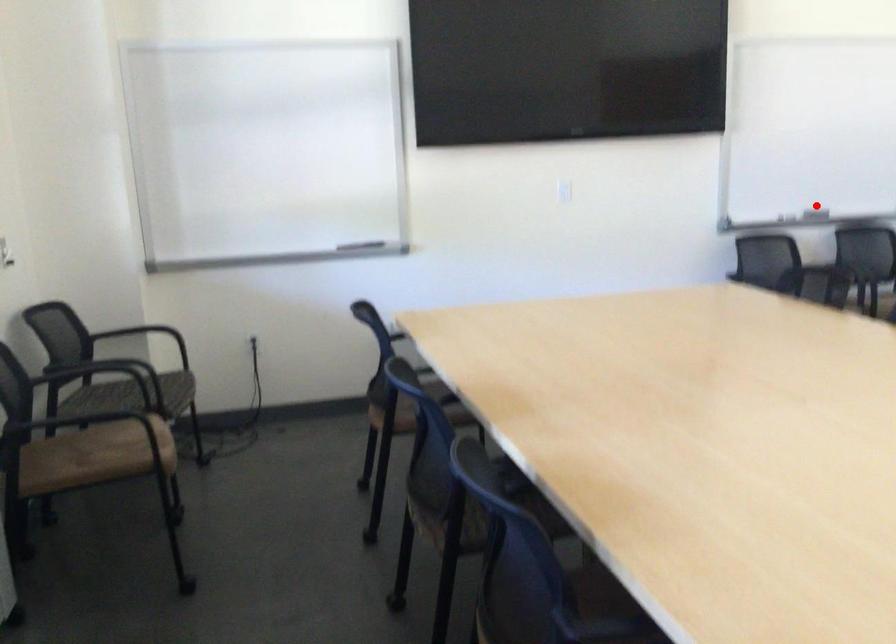
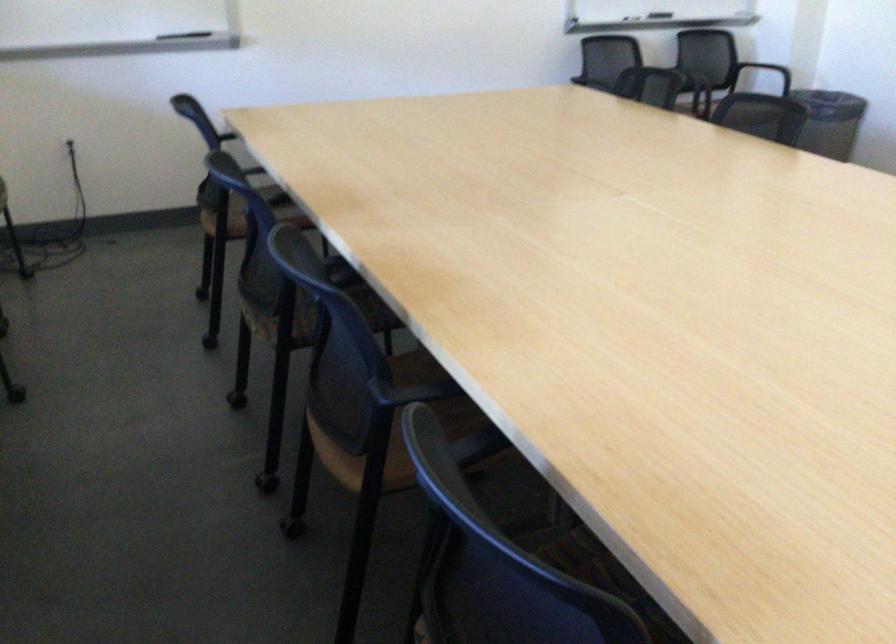
The point at the highlighted location is marked in the first image. Where is the corresponding point in the second image?

(655, 15)